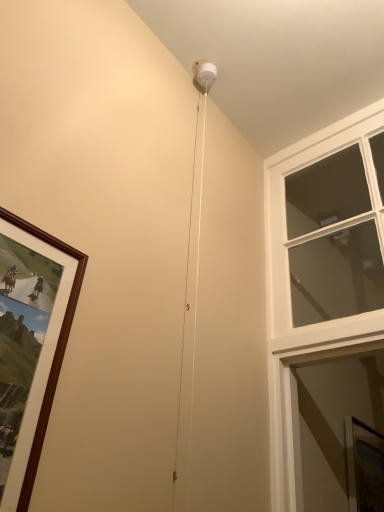
In order to face clear glass window screen at lower right, should I rotate leftwards or rightwards?

Turn right approximately 23.413 degrees to face it.

The height and width of the screenshot is (512, 384). What do you see at coordinates (364, 467) in the screenshot?
I see `clear glass window screen at lower right` at bounding box center [364, 467].

Measure the distance between point (360, 451) and camera.

Point (360, 451) is 1.76 meters from camera.

Where is `clear glass window screen at lower right`? Image resolution: width=384 pixels, height=512 pixels. clear glass window screen at lower right is located at coordinates (364, 467).

The image size is (384, 512). What do you see at coordinates (327, 228) in the screenshot?
I see `clear glass window at upper right` at bounding box center [327, 228].

Identify the location of clear glass window at upper right. (327, 228).

Where is `clear glass window screen at lower right`? Image resolution: width=384 pixels, height=512 pixels. clear glass window screen at lower right is located at coordinates (364, 467).

Which object is positioned more to the left, clear glass window at upper right or clear glass window screen at lower right?

clear glass window at upper right is more to the left.

Considering the relative positions of clear glass window at upper right and clear glass window screen at lower right in the image provided, is clear glass window at upper right behind clear glass window screen at lower right?

No, clear glass window at upper right is closer to the camera.

Considering the points (351, 178) and (372, 488), which point is in front, point (351, 178) or point (372, 488)?

The point (372, 488) is closer to the camera.

From the image's perspective, which is below, clear glass window at upper right or clear glass window screen at lower right?

clear glass window screen at lower right.

From a real-world perspective, which is physically below, clear glass window at upper right or clear glass window screen at lower right?

clear glass window screen at lower right is physically lower.

In terms of width, does clear glass window at upper right look wider or thinner when compared to clear glass window screen at lower right?

Considering their sizes, clear glass window at upper right looks broader than clear glass window screen at lower right.

Can you confirm if clear glass window at upper right is taller than clear glass window screen at lower right?

Indeed, clear glass window at upper right has a greater height compared to clear glass window screen at lower right.

Can you confirm if clear glass window at upper right is bigger than clear glass window screen at lower right?

Yes, clear glass window at upper right is bigger than clear glass window screen at lower right.

Is clear glass window screen at lower right inside clear glass window at upper right?

Actually, clear glass window screen at lower right is outside clear glass window at upper right.

Consider the image. Is clear glass window at upper right next to clear glass window screen at lower right and touching it?

No, clear glass window at upper right is not next to clear glass window screen at lower right.

Is clear glass window screen at lower right at the back of clear glass window at upper right?

Yes, clear glass window at upper right is facing away from clear glass window screen at lower right.

How distant is clear glass window at upper right from clear glass window screen at lower right?

The distance of clear glass window at upper right from clear glass window screen at lower right is 31.14 inches.

There is a clear glass window screen at lower right. Where is `window above it (from a real-world perspective)`? This screenshot has width=384, height=512. window above it (from a real-world perspective) is located at coordinates (327, 228).

Which object is positioned more to the right, clear glass window screen at lower right or clear glass window at upper right?

clear glass window screen at lower right is more to the right.

In the image, is clear glass window screen at lower right positioned in front of or behind clear glass window at upper right?

In the image, clear glass window screen at lower right appears behind clear glass window at upper right.

Does point (352, 502) appear closer or farther from the camera than point (321, 309)?

Point (352, 502) is closer to the camera than point (321, 309).

From the image's perspective, is clear glass window screen at lower right positioned above or below clear glass window at upper right?

Clearly, from the image's perspective, clear glass window screen at lower right is below clear glass window at upper right.

From a real-world perspective, does clear glass window screen at lower right sit lower than clear glass window at upper right?

Yes.

Which of these two, clear glass window screen at lower right or clear glass window at upper right, is thinner?

clear glass window screen at lower right.

Considering the relative sizes of clear glass window screen at lower right and clear glass window at upper right in the image provided, is clear glass window screen at lower right shorter than clear glass window at upper right?

Yes, clear glass window screen at lower right is shorter than clear glass window at upper right.

Considering the relative sizes of clear glass window screen at lower right and clear glass window at upper right in the image provided, is clear glass window screen at lower right smaller than clear glass window at upper right?

Correct, clear glass window screen at lower right occupies less space than clear glass window at upper right.

Can we say clear glass window screen at lower right lies outside clear glass window at upper right?

That's correct, clear glass window screen at lower right is outside of clear glass window at upper right.

Are clear glass window screen at lower right and clear glass window at upper right far apart?

They are positioned close to each other.

Could you tell me if clear glass window screen at lower right is facing clear glass window at upper right?

No, clear glass window screen at lower right is not facing towards clear glass window at upper right.

Measure the distance from clear glass window screen at lower right to clear glass window at upper right.

clear glass window screen at lower right and clear glass window at upper right are 79.08 centimeters apart.

At what (x,y) coordinates should I click in order to perform the action: click on window screen located underneath the clear glass window at upper right (from a real-world perspective). Please return your answer as a coordinate pair (x, y). The height and width of the screenshot is (512, 384). Looking at the image, I should click on (364, 467).

The width and height of the screenshot is (384, 512). What are the coordinates of `window above the clear glass window screen at lower right (from the image's perspective)` in the screenshot? It's located at (327, 228).

Identify the location of window located above the clear glass window screen at lower right (from a real-world perspective). (327, 228).